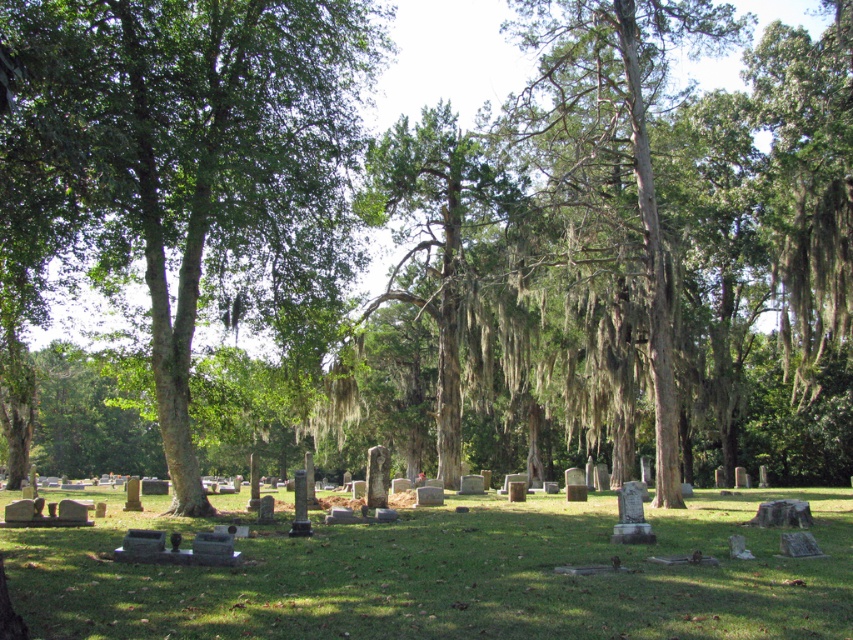
Question: Which point is closer to the camera?

Choices:
 (A) green leafy tree at left
 (B) green mossy bark tree at center

Answer: (A)

Question: Which object is closer to the camera taking this photo?

Choices:
 (A) green mossy tree at center
 (B) green leafy tree at left
 (C) green mossy bark tree at center
 (D) gray concrete tombstones at center

Answer: (D)

Question: Is green leafy tree at left behind gray concrete tombstones at center?

Choices:
 (A) no
 (B) yes

Answer: (B)

Question: Can you confirm if green leafy tree at left is bigger than green mossy bark tree at center?

Choices:
 (A) no
 (B) yes

Answer: (B)

Question: Can you confirm if green mossy bark tree at center is positioned below green mossy tree at center?

Choices:
 (A) yes
 (B) no

Answer: (A)

Question: Estimate the real-world distances between objects in this image. Which object is closer to the green mossy bark tree at center?

Choices:
 (A) gray concrete tombstones at center
 (B) green mossy tree at center

Answer: (B)